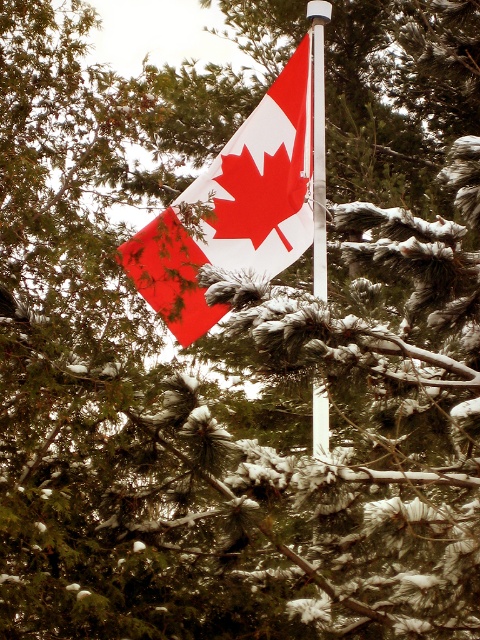
Question: Does matte plastic flag at center have a lesser width compared to white metallic pole at center?

Choices:
 (A) no
 (B) yes

Answer: (A)

Question: Which point is closer to the camera?

Choices:
 (A) (307, 112)
 (B) (314, 12)

Answer: (A)

Question: Observing the image, what is the correct spatial positioning of matte plastic flag at center in reference to white metallic pole at center?

Choices:
 (A) left
 (B) right

Answer: (A)

Question: Which point is farther to the camera?

Choices:
 (A) (228, 182)
 (B) (317, 99)

Answer: (A)

Question: Can you confirm if matte plastic flag at center is smaller than white metallic pole at center?

Choices:
 (A) no
 (B) yes

Answer: (A)

Question: Among these points, which one is nearest to the camera?

Choices:
 (A) (312, 193)
 (B) (200, 240)

Answer: (B)